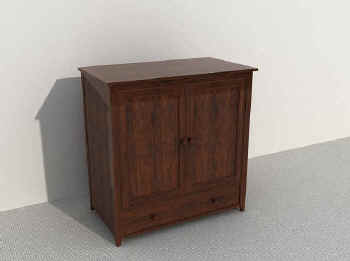
Find the location of `space to the right of the cabinet`. space to the right of the cabinet is located at coordinates (261, 170).